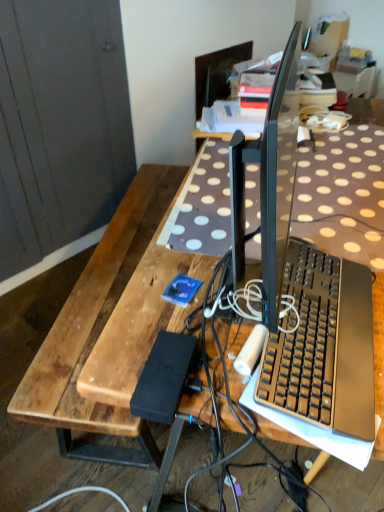
Looking at this image, in order to face brown wooden bench at left, should I rotate leftwards or rightwards?

To align with it, rotate left about 6.059°.

Measure the distance between point (141, 184) and camera.

Point (141, 184) and camera are 6.46 feet apart from each other.

Image resolution: width=384 pixels, height=512 pixels. What do you see at coordinates (95, 314) in the screenshot?
I see `brown wooden bench at left` at bounding box center [95, 314].

Find the location of a particular element. This screenshot has width=384, height=512. brown wooden bench at left is located at coordinates (95, 314).

Where is `black plastic keyboard at center`? This screenshot has height=512, width=384. black plastic keyboard at center is located at coordinates (323, 345).

The image size is (384, 512). What do you see at coordinates (323, 345) in the screenshot?
I see `black plastic keyboard at center` at bounding box center [323, 345].

Where is `brown wooden bench at left`? Image resolution: width=384 pixels, height=512 pixels. brown wooden bench at left is located at coordinates (95, 314).

Is black plastic keyboard at center at the right side of brown wooden bench at left?

Indeed, black plastic keyboard at center is positioned on the right side of brown wooden bench at left.

Is the position of black plastic keyboard at center more distant than that of brown wooden bench at left?

No, black plastic keyboard at center is closer to the viewer.

Is point (312, 372) positioned in front of point (150, 239)?

Yes.

From the image's perspective, is black plastic keyboard at center above brown wooden bench at left?

Yes.

From a real-world perspective, is black plastic keyboard at center positioned above or below brown wooden bench at left?

Clearly, from a real-world perspective, black plastic keyboard at center is above brown wooden bench at left.

Can you confirm if black plastic keyboard at center is thinner than brown wooden bench at left?

Yes.

Considering the relative sizes of black plastic keyboard at center and brown wooden bench at left in the image provided, is black plastic keyboard at center taller than brown wooden bench at left?

Incorrect, the height of black plastic keyboard at center is not larger of that of brown wooden bench at left.

In terms of size, does black plastic keyboard at center appear bigger or smaller than brown wooden bench at left?

In the image, black plastic keyboard at center appears to be smaller than brown wooden bench at left.

Can we say black plastic keyboard at center lies outside brown wooden bench at left?

That's correct, black plastic keyboard at center is outside of brown wooden bench at left.

Is black plastic keyboard at center placed right next to brown wooden bench at left?

No, black plastic keyboard at center is not making contact with brown wooden bench at left.

Is brown wooden bench at left at the back of black plastic keyboard at center?

That's not correct — black plastic keyboard at center is not looking away from brown wooden bench at left.

The width and height of the screenshot is (384, 512). Find the location of `wood below the black plastic keyboard at center (from the image's perspective)`. wood below the black plastic keyboard at center (from the image's perspective) is located at coordinates (95, 314).

Which object is positioned more to the left, brown wooden bench at left or black plastic keyboard at center?

brown wooden bench at left is more to the left.

Which object is further away from the camera taking this photo, brown wooden bench at left or black plastic keyboard at center?

brown wooden bench at left is more distant.

Is point (103, 304) more distant than point (335, 403)?

Yes, it is behind point (335, 403).

From the image's perspective, does brown wooden bench at left appear lower than black plastic keyboard at center?

Yes, from the image's perspective, brown wooden bench at left is below black plastic keyboard at center.

From a real-world perspective, who is located higher, brown wooden bench at left or black plastic keyboard at center?

black plastic keyboard at center.

Does brown wooden bench at left have a lesser width compared to black plastic keyboard at center?

In fact, brown wooden bench at left might be wider than black plastic keyboard at center.

Which of these two, brown wooden bench at left or black plastic keyboard at center, stands shorter?

black plastic keyboard at center is shorter.

Considering the relative sizes of brown wooden bench at left and black plastic keyboard at center in the image provided, is brown wooden bench at left smaller than black plastic keyboard at center?

No.

Can we say brown wooden bench at left lies outside black plastic keyboard at center?

Indeed, brown wooden bench at left is completely outside black plastic keyboard at center.

Is brown wooden bench at left directly adjacent to black plastic keyboard at center?

There is a gap between brown wooden bench at left and black plastic keyboard at center.

Could you tell me if brown wooden bench at left is turned towards black plastic keyboard at center?

No, brown wooden bench at left is not aimed at black plastic keyboard at center.

How distant is brown wooden bench at left from black plastic keyboard at center?

brown wooden bench at left and black plastic keyboard at center are 25.44 inches apart.

At what (x,y) coordinates should I click in order to perform the action: click on wood on the left of black plastic keyboard at center. Please return your answer as a coordinate pair (x, y). This screenshot has width=384, height=512. Looking at the image, I should click on (95, 314).

You are a GUI agent. You are given a task and a screenshot of the screen. Output one action in this format:
    pyautogui.click(x=<x>, y=<y>)
    Task: Click on the wood below the black plastic keyboard at center (from a real-world perspective)
    The image size is (384, 512).
    Given the screenshot: What is the action you would take?
    pyautogui.click(x=95, y=314)

Identify the location of wood located below the black plastic keyboard at center (from the image's perspective). Image resolution: width=384 pixels, height=512 pixels. (95, 314).